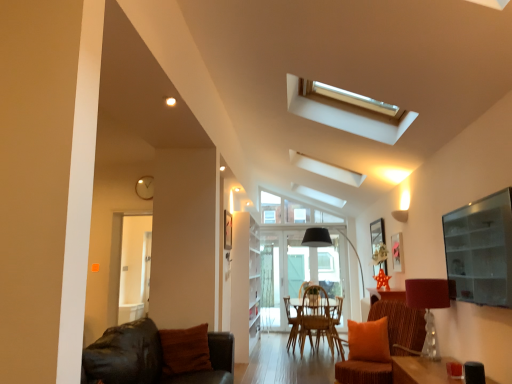
Question: From a real-world perspective, is transparent glass door at center, which is the first glass door from back to front, positioned over brown fuzzy pillow at lower left based on gravity?

Choices:
 (A) yes
 (B) no

Answer: (A)

Question: Is the position of transparent glass door at center, the first glass door in the right-to-left sequence, less distant than that of brown fuzzy pillow at lower left?

Choices:
 (A) yes
 (B) no

Answer: (B)

Question: Is the position of transparent glass door at center, the 2th glass door positioned from the front, more distant than that of brown fuzzy pillow at lower left?

Choices:
 (A) no
 (B) yes

Answer: (B)

Question: Considering the relative sizes of transparent glass door at center, the 2th glass door positioned from the front, and brown fuzzy pillow at lower left in the image provided, is transparent glass door at center, the 2th glass door positioned from the front, smaller than brown fuzzy pillow at lower left?

Choices:
 (A) yes
 (B) no

Answer: (B)

Question: Can brown fuzzy pillow at lower left be found inside transparent glass door at center, which is the first glass door from back to front?

Choices:
 (A) no
 (B) yes

Answer: (A)

Question: Is transparent glass door at center, the first glass door in the right-to-left sequence, turned away from brown fuzzy pillow at lower left?

Choices:
 (A) yes
 (B) no

Answer: (B)

Question: Does orange fabric chair at lower right, which appears as the 1th chair when viewed from the front, have a greater height compared to rustic wood chair at center, which appears as the 2th chair when viewed from the front?

Choices:
 (A) no
 (B) yes

Answer: (A)

Question: Is orange fabric chair at lower right, arranged as the 2th chair when viewed from the back, thinner than rustic wood chair at center, the first chair in the back-to-front sequence?

Choices:
 (A) yes
 (B) no

Answer: (B)

Question: From the image's perspective, is orange fabric chair at lower right, arranged as the 2th chair when viewed from the back, above rustic wood chair at center, the first chair in the back-to-front sequence?

Choices:
 (A) yes
 (B) no

Answer: (A)

Question: Considering the relative positions of orange fabric chair at lower right, which appears as the 1th chair when viewed from the front, and rustic wood chair at center, the first chair in the back-to-front sequence, in the image provided, is orange fabric chair at lower right, which appears as the 1th chair when viewed from the front, to the right of rustic wood chair at center, the first chair in the back-to-front sequence, from the viewer's perspective?

Choices:
 (A) yes
 (B) no

Answer: (A)

Question: Can you confirm if orange fabric chair at lower right, which appears as the 1th chair when viewed from the front, is bigger than rustic wood chair at center, the first chair in the back-to-front sequence?

Choices:
 (A) no
 (B) yes

Answer: (B)

Question: Is orange fabric chair at lower right, arranged as the 2th chair when viewed from the back, to the left of rustic wood chair at center, which appears as the 2th chair when viewed from the front, from the viewer's perspective?

Choices:
 (A) no
 (B) yes

Answer: (A)

Question: Considering the relative positions of brown woven armchair at center and translucent glass lampshade at right in the image provided, is brown woven armchair at center to the right of translucent glass lampshade at right from the viewer's perspective?

Choices:
 (A) yes
 (B) no

Answer: (B)